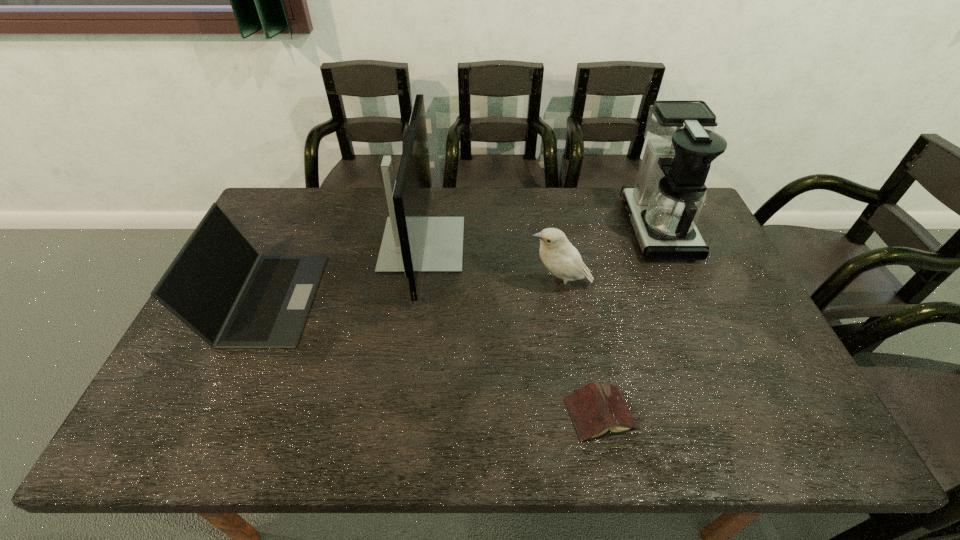
What are the coordinates of `vacant area in the image that satisfies the following two spatial constraints: 1. on the screen of the computer monitor; 2. on the right side of the book` in the screenshot? It's located at (399, 414).